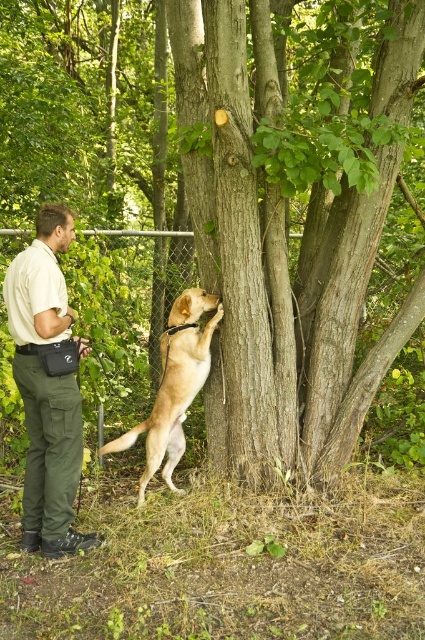
Question: From the image, what is the correct spatial relationship of khaki cotton shirt at center in relation to golden fur dog at center?

Choices:
 (A) above
 (B) below

Answer: (A)

Question: Which of the following is the closest to the observer?

Choices:
 (A) khaki cotton shirt at center
 (B) golden fur dog at center

Answer: (A)

Question: Which point appears closest to the camera in this image?

Choices:
 (A) (25, 497)
 (B) (201, 310)

Answer: (A)

Question: Is khaki cotton shirt at center above golden fur dog at center?

Choices:
 (A) yes
 (B) no

Answer: (A)

Question: Can you confirm if khaki cotton shirt at center is positioned to the left of golden fur dog at center?

Choices:
 (A) no
 (B) yes

Answer: (B)